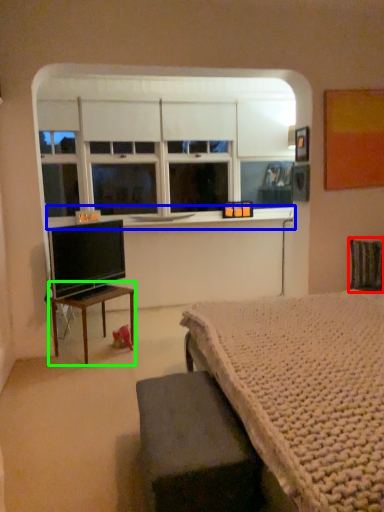
Question: Which object is positioned farthest from swivel chair (highlighted by a red box)? Select from window sill (highlighted by a blue box) and table (highlighted by a green box).

Choices:
 (A) window sill
 (B) table

Answer: (B)